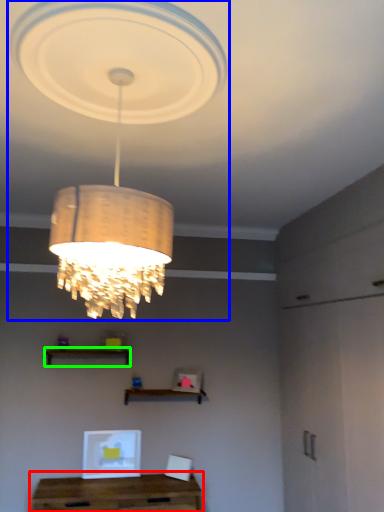
Question: Estimate the real-world distances between objects in this image. Which object is farther from table (highlighted by a red box), lamp (highlighted by a blue box) or shelf (highlighted by a green box)?

Choices:
 (A) lamp
 (B) shelf

Answer: (A)